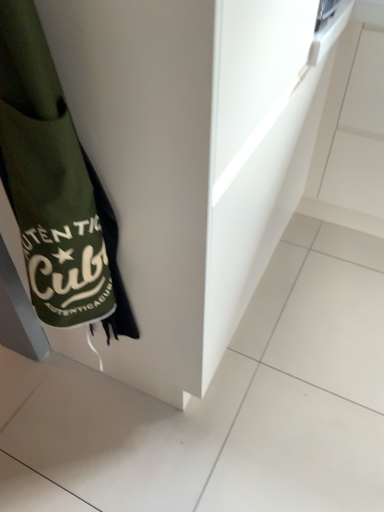
Locate an element on the screen. Image resolution: width=384 pixels, height=512 pixels. green fabric bag at left is located at coordinates (55, 188).

Describe the element at coordinates (55, 188) in the screenshot. I see `green fabric bag at left` at that location.

Where is `green fabric bag at left`? green fabric bag at left is located at coordinates (55, 188).